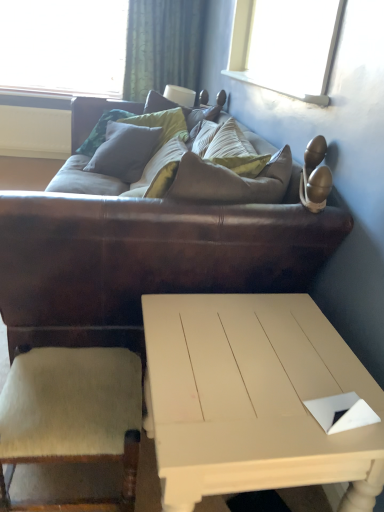
Where is `free space above beige wool armchair at lower left (from a real-world perspective)`? Image resolution: width=384 pixels, height=512 pixels. free space above beige wool armchair at lower left (from a real-world perspective) is located at coordinates (62, 386).